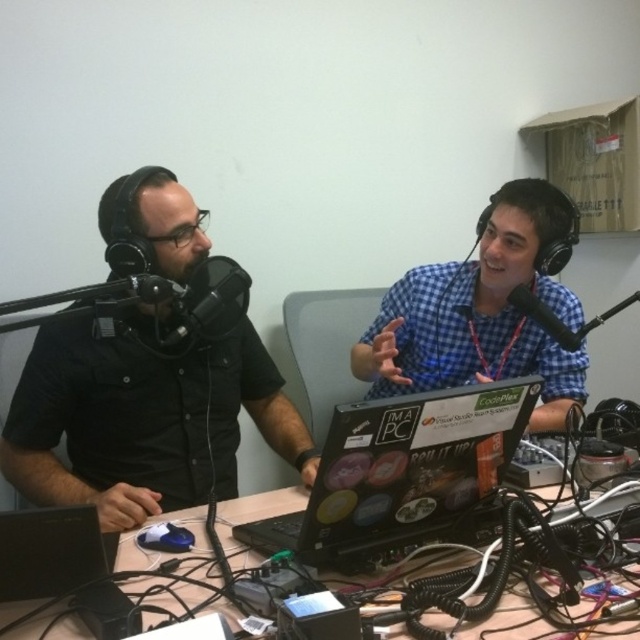
Between blue checkered shirt at center and wooden table at center, which one is positioned lower?

Positioned lower is wooden table at center.

Can you confirm if blue checkered shirt at center is taller than wooden table at center?

Yes.

Between point (544, 364) and point (38, 627), which one is positioned in front?

Point (38, 627) is more forward.

This screenshot has height=640, width=640. Find the location of `blue checkered shirt at center`. blue checkered shirt at center is located at coordinates [481, 314].

Who is taller, wooden table at center or black matte microphone at right?

Standing taller between the two is black matte microphone at right.

Does wooden table at center appear under black matte microphone at right?

Indeed, wooden table at center is positioned under black matte microphone at right.

What do you see at coordinates (256, 509) in the screenshot? Image resolution: width=640 pixels, height=640 pixels. I see `wooden table at center` at bounding box center [256, 509].

Image resolution: width=640 pixels, height=640 pixels. I want to click on wooden table at center, so click(x=256, y=509).

Is black matte shirt at left wider than wooden table at center?

Incorrect, black matte shirt at left's width does not surpass wooden table at center's.

Where is `black matte shirt at left`? black matte shirt at left is located at coordinates (141, 422).